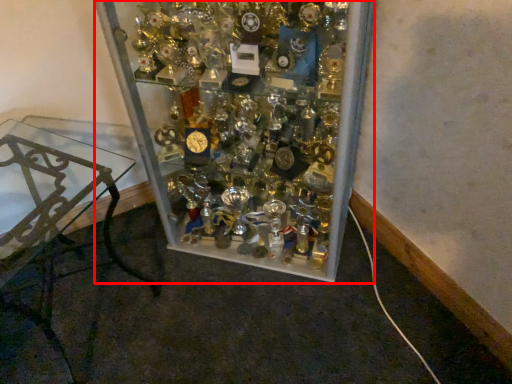
Question: Considering the relative positions of glass box (annotated by the red box) and furniture in the image provided, where is glass box (annotated by the red box) located with respect to the staircase?

Choices:
 (A) right
 (B) left

Answer: (A)